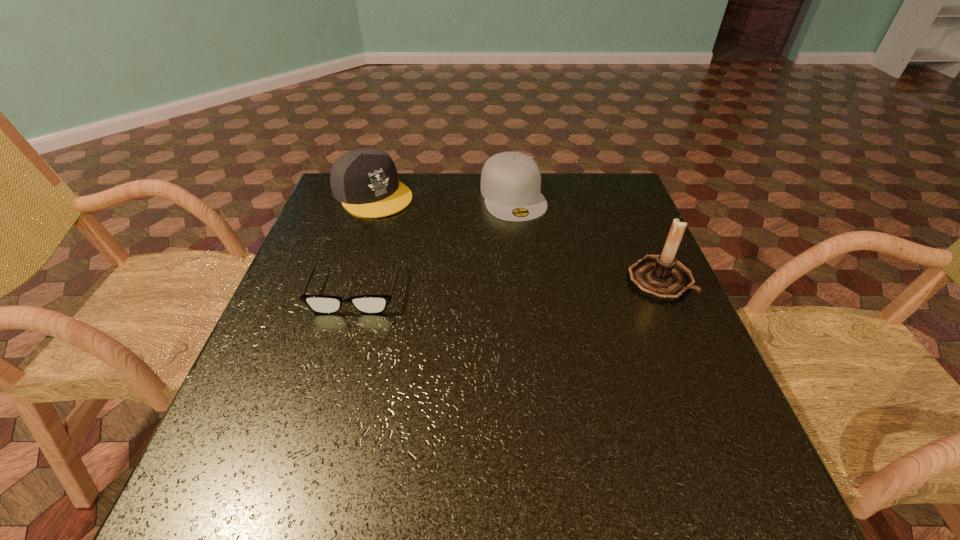
Find the location of `unoccupied position between the shortest object and the left cap`. unoccupied position between the shortest object and the left cap is located at coordinates (365, 242).

Where is `free space between the right cap and the tallest object`? The height and width of the screenshot is (540, 960). free space between the right cap and the tallest object is located at coordinates (587, 238).

Identify which object is located as the nearest to the left cap. Please provide its 2D coordinates. Your answer should be formatted as a tuple, i.e. [(x, y)], where the tuple contains the x and y coordinates of a point satisfying the conditions above.

[(510, 181)]

Find the location of a particular element. The height and width of the screenshot is (540, 960). the closest object to the second object from right to left is located at coordinates (365, 181).

Where is `vacant point that satisfies the following two spatial constraints: 1. on the front side of the right cap; 2. on the right side of the tallest object`? vacant point that satisfies the following two spatial constraints: 1. on the front side of the right cap; 2. on the right side of the tallest object is located at coordinates (521, 280).